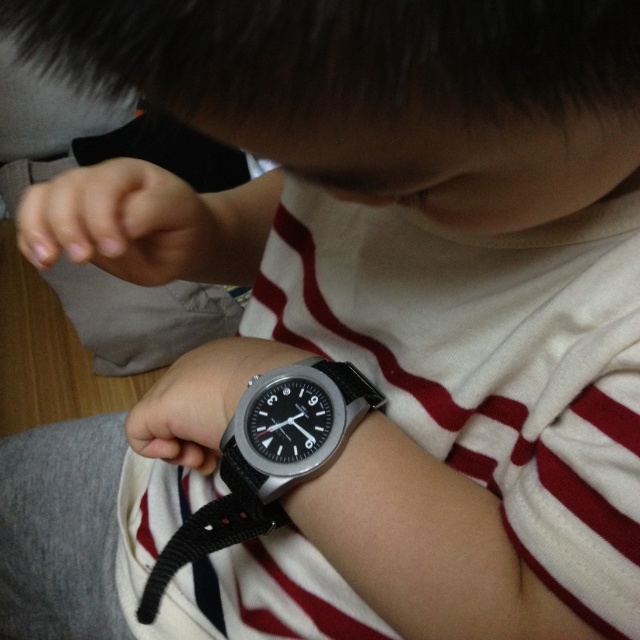
You are a photographer trying to capture the black rubber watch at center and the black rubber watch at lower center in a clear shot. Which watch should you focus on first if you want to ensure both are in focus, given their positions?

The black rubber watch at lower center should be focused on first because it is positioned higher than the black rubber watch at center, allowing for better depth of field coverage when focusing on the closer object first.

You are a watch repair technician examining two black rubber watches on a customer. The customer mentions they want to know which watch is smaller in height. You see the black rubber watch at center and the black rubber watch at lower center. Which one is shorter in height?

The black rubber watch at center has a lesser height compared to the black rubber watch at lower center, so the black rubber watch at center is shorter in height.